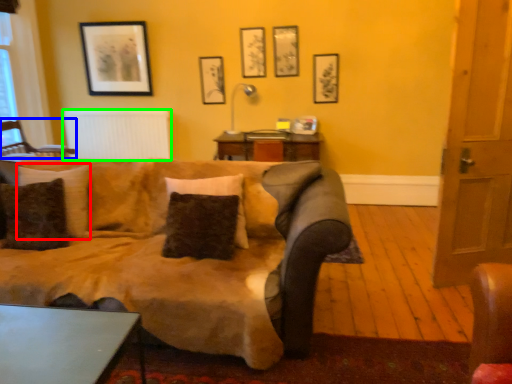
Question: Estimate the real-world distances between objects in this image. Which object is closer to pillow (highlighted by a red box), chair (highlighted by a blue box) or radiator (highlighted by a green box)?

Choices:
 (A) chair
 (B) radiator

Answer: (A)